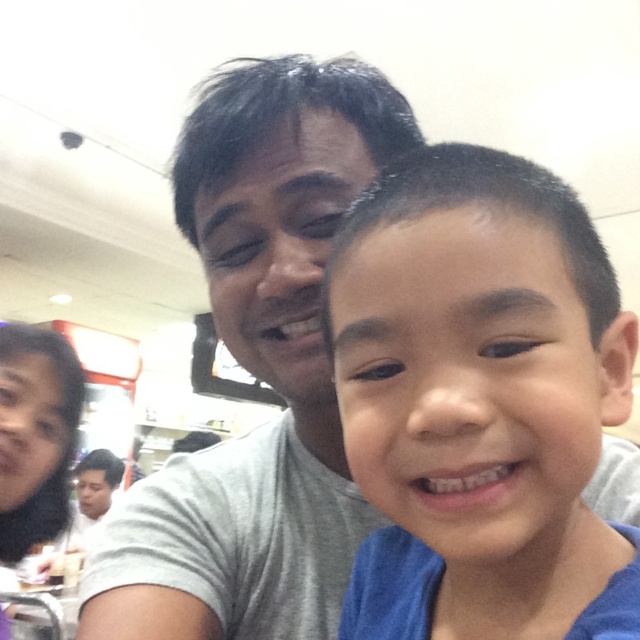
Question: Which point is farther to the camera?

Choices:
 (A) (125, 497)
 (B) (513, 352)

Answer: (A)

Question: Does blue cotton shirt at right have a smaller size compared to gray cotton shirt at center?

Choices:
 (A) no
 (B) yes

Answer: (B)

Question: Observing the image, what is the correct spatial positioning of blue cotton shirt at right in reference to gray cotton shirt at center?

Choices:
 (A) right
 (B) left

Answer: (A)

Question: From the image, what is the correct spatial relationship of blue cotton shirt at right in relation to gray cotton shirt at center?

Choices:
 (A) left
 (B) right

Answer: (B)